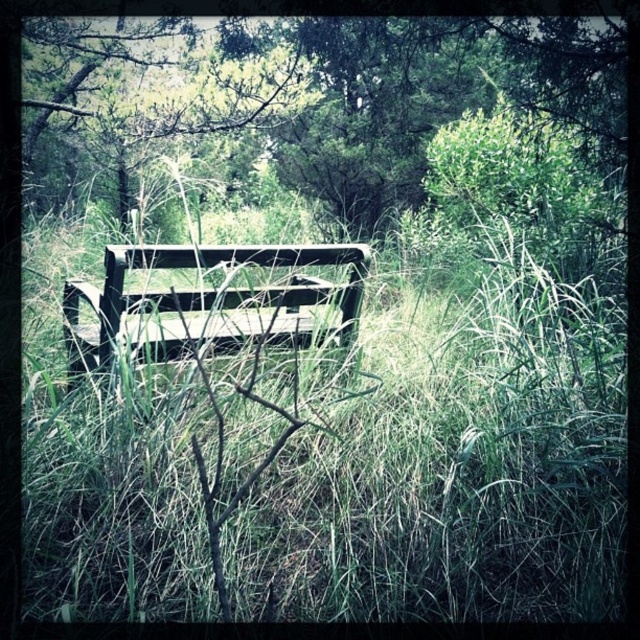
Can you confirm if green matte bench at center is positioned below wooden park bench at center?

No.

Is point (600, 32) farther from viewer compared to point (104, 323)?

That is True.

Is point (330, 204) in front of point (224, 252)?

No, (330, 204) is further to viewer.

Where is `green matte bench at center`? green matte bench at center is located at coordinates (342, 90).